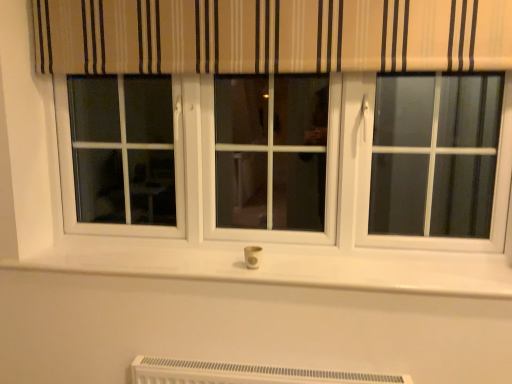
Question: Is point (251, 256) positioned closer to the camera than point (204, 380)?

Choices:
 (A) farther
 (B) closer

Answer: (A)

Question: From the image's perspective, relative to white plastic heater at lower center, is white plastic outlet at center above or below?

Choices:
 (A) above
 (B) below

Answer: (A)

Question: From a real-world perspective, is white plastic outlet at center physically located above or below white plastic heater at lower center?

Choices:
 (A) above
 (B) below

Answer: (A)

Question: Considering their positions, is white plastic heater at lower center located in front of or behind white plastic outlet at center?

Choices:
 (A) front
 (B) behind

Answer: (A)

Question: From a real-world perspective, is white plastic heater at lower center positioned above or below white plastic outlet at center?

Choices:
 (A) below
 (B) above

Answer: (A)

Question: From their relative heights in the image, would you say white plastic heater at lower center is taller or shorter than white plastic outlet at center?

Choices:
 (A) tall
 (B) short

Answer: (A)

Question: Does point (181, 365) appear closer or farther from the camera than point (248, 258)?

Choices:
 (A) closer
 (B) farther

Answer: (A)